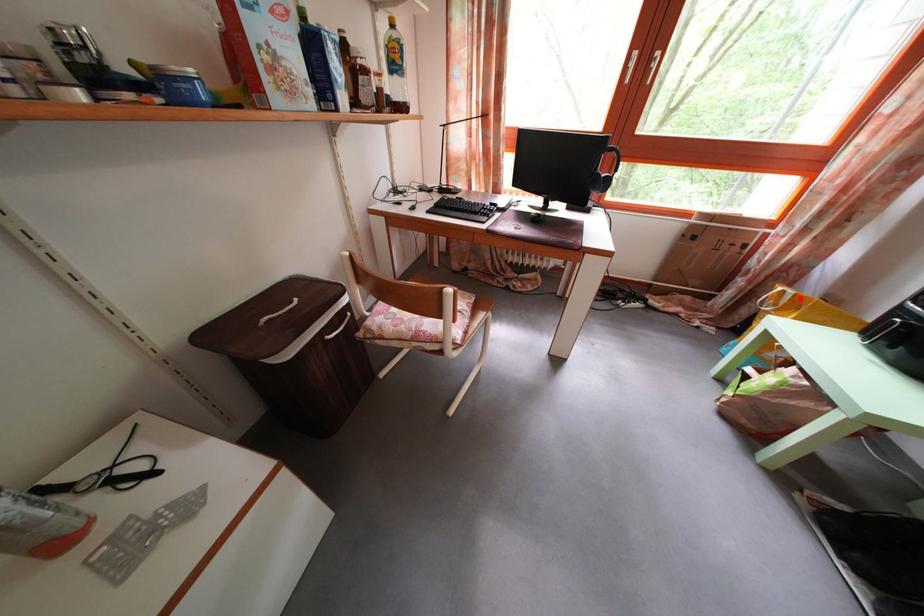
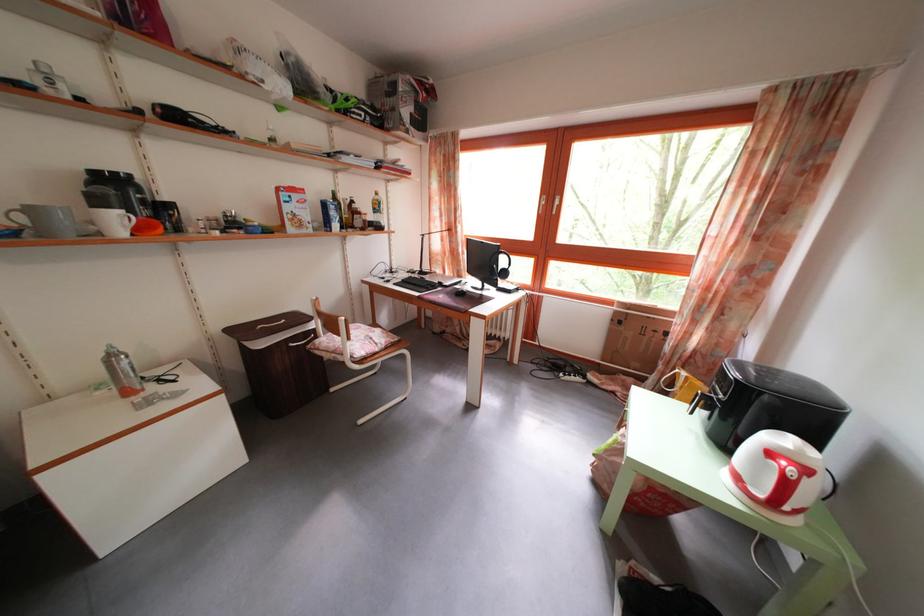
The point at the highlighted location is marked in the first image. Where is the corresponding point in the second image?

(691, 381)